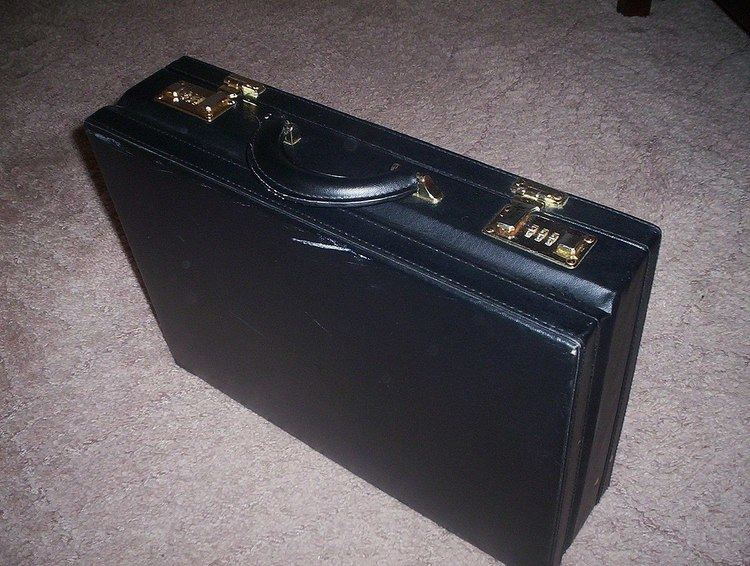
The image size is (750, 566). I want to click on photo of a brief case sitting on the floor, so click(140, 460).